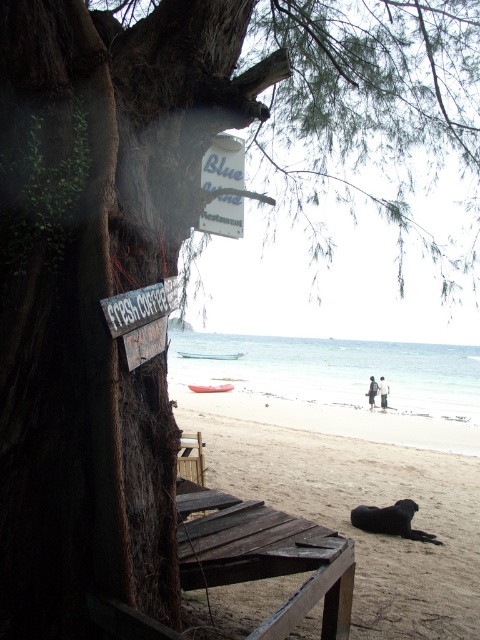
Question: Observing the image, what is the correct spatial positioning of brown sandy beach at lower center in reference to weathered wood chair at lower center?

Choices:
 (A) left
 (B) right

Answer: (B)

Question: Among these objects, which one is nearest to the camera?

Choices:
 (A) weathered wood chair at lower center
 (B) white paper sign at upper center

Answer: (A)

Question: Based on their relative distances, which object is farther from the brown sandy beach at lower center?

Choices:
 (A) white paper sign at upper center
 (B) weathered wood chair at lower center

Answer: (A)

Question: Estimate the real-world distances between objects in this image. Which object is closer to the weathered wood chair at lower center?

Choices:
 (A) brown sandy beach at lower center
 (B) white paper sign at upper center

Answer: (B)

Question: Can you confirm if weathered wood chair at lower center is smaller than white paper sign at upper center?

Choices:
 (A) no
 (B) yes

Answer: (A)

Question: Does brown sandy beach at lower center appear on the right side of weathered wood chair at lower center?

Choices:
 (A) no
 (B) yes

Answer: (B)